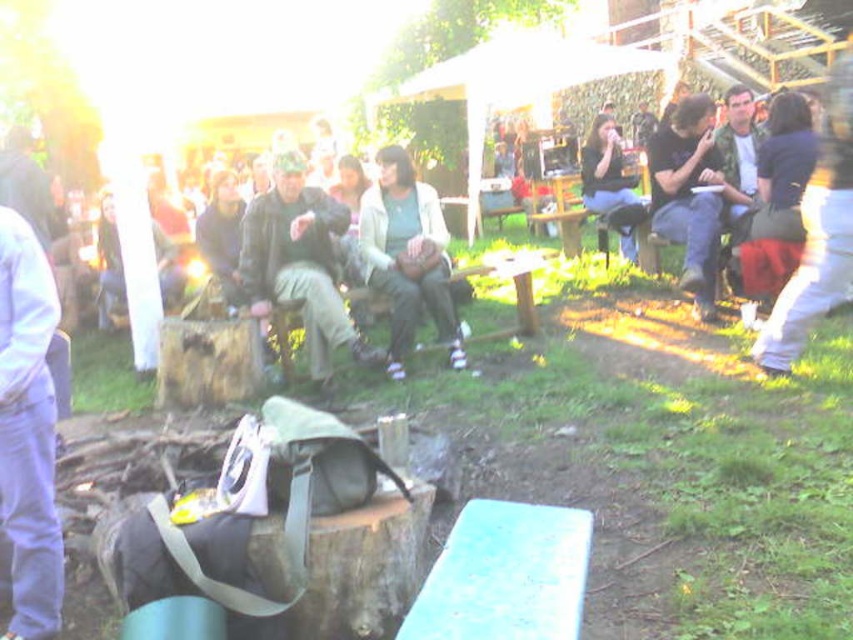
You are standing at the entrance of the gathering area and want to find the camouflage jacket at center. According to the coordinate system where the bottom left corner is the origin, which direction should you move to locate it?

The camouflage jacket at center is located at point (300,260) in the coordinate system. Since the y coordinate is 0.353, which is less than 0.5, it is closer to the bottom of the image. The x coordinate 0.409 is near the center horizontally. Therefore, you should move towards the center and slightly upwards from the bottom to find it.

You are organizing a small event and need to decide which garment to use as a makeshift tablecloth between the camouflage jacket at center and the light beige sweater at center. Which one would be wider and thus more suitable for covering a larger surface?

The camouflage jacket at center is wider than the light beige sweater at center, so it would be more suitable for covering a larger surface.